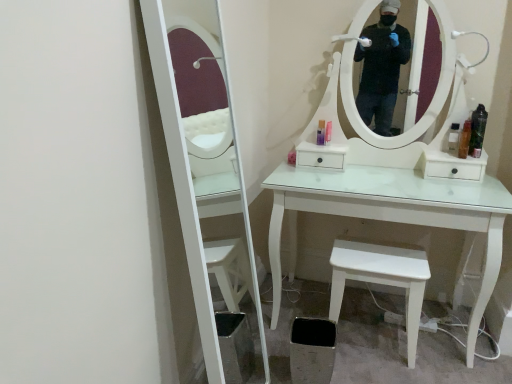
Question: Considering the relative sizes of white matte stool at lower right and clear plastic bottle at right, which is the 3th toiletry from right to left, in the image provided, is white matte stool at lower right wider than clear plastic bottle at right, which is the 3th toiletry from right to left,?

Choices:
 (A) no
 (B) yes

Answer: (B)

Question: Is white matte stool at lower right directly adjacent to clear plastic bottle at right, the third toiletry when ordered from left to right?

Choices:
 (A) yes
 (B) no

Answer: (B)

Question: Considering the relative sizes of white matte stool at lower right and clear plastic bottle at right, which is the 3th toiletry from right to left, in the image provided, is white matte stool at lower right smaller than clear plastic bottle at right, which is the 3th toiletry from right to left,?

Choices:
 (A) no
 (B) yes

Answer: (A)

Question: Is white matte stool at lower right far away from clear plastic bottle at right, the third toiletry when ordered from left to right?

Choices:
 (A) no
 (B) yes

Answer: (A)

Question: Does white matte stool at lower right lie behind clear plastic bottle at right, the third toiletry when ordered from left to right?

Choices:
 (A) no
 (B) yes

Answer: (A)

Question: Is point (328, 127) positioned closer to the camera than point (472, 122)?

Choices:
 (A) farther
 (B) closer

Answer: (A)

Question: Is pink plastic bottle at center, marked as the 4th toiletry in a right-to-left arrangement, in front of or behind translucent plastic bottle at right, placed as the 5th toiletry when sorted from left to right, in the image?

Choices:
 (A) front
 (B) behind

Answer: (B)

Question: From the image's perspective, relative to translucent plastic bottle at right, the 1th toiletry viewed from the right, is pink plastic bottle at center, which appears as the second toiletry when viewed from the left, above or below?

Choices:
 (A) above
 (B) below

Answer: (A)

Question: From a real-world perspective, relative to translucent plastic bottle at right, placed as the 5th toiletry when sorted from left to right, is pink plastic bottle at center, marked as the 4th toiletry in a right-to-left arrangement, vertically above or below?

Choices:
 (A) above
 (B) below

Answer: (B)

Question: Looking at their shapes, would you say matte purple bottle at center, the 1th toiletry from the left, is wider or thinner than translucent plastic bottle at right, acting as the 2th toiletry starting from the right?

Choices:
 (A) wide
 (B) thin

Answer: (B)

Question: From the image's perspective, relative to translucent plastic bottle at right, acting as the 2th toiletry starting from the right, is matte purple bottle at center, the 1th toiletry from the left, above or below?

Choices:
 (A) above
 (B) below

Answer: (A)

Question: Is matte purple bottle at center, the 1th toiletry from the left, to the left or to the right of translucent plastic bottle at right, acting as the 2th toiletry starting from the right, in the image?

Choices:
 (A) right
 (B) left

Answer: (B)

Question: Based on their sizes in the image, would you say matte purple bottle at center, placed as the fifth toiletry when sorted from right to left, is bigger or smaller than translucent plastic bottle at right, the fourth toiletry when ordered from left to right?

Choices:
 (A) big
 (B) small

Answer: (B)

Question: Is translucent plastic bottle at right, acting as the 2th toiletry starting from the right, inside the boundaries of pink plastic bottle at center, marked as the 4th toiletry in a right-to-left arrangement, or outside?

Choices:
 (A) inside
 (B) outside

Answer: (B)

Question: Is point (466, 145) positioned closer to the camera than point (326, 134)?

Choices:
 (A) closer
 (B) farther

Answer: (A)